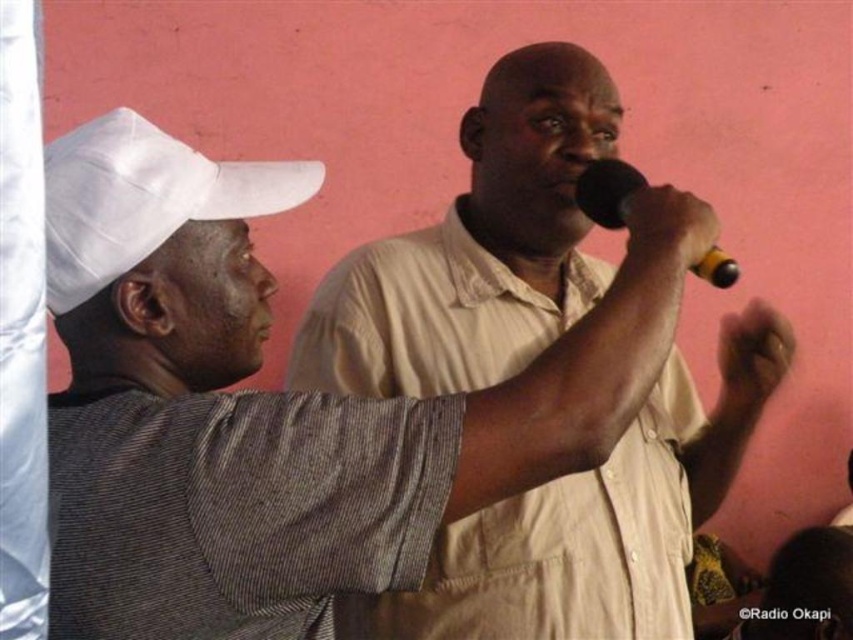
Question: Which object is closer to the camera taking this photo?

Choices:
 (A) black plastic microphone at upper center
 (B) white fabric cap at left
 (C) beige striped shirt at center

Answer: (B)

Question: Which of the following is the farthest from the observer?

Choices:
 (A) pos(624,179)
 (B) pos(48,195)
 (C) pos(654,513)

Answer: (C)

Question: Which object is the closest to the white fabric cap at left?

Choices:
 (A) black plastic microphone at upper center
 (B) beige striped shirt at center

Answer: (B)

Question: Does white fabric cap at left appear on the right side of black plastic microphone at upper center?

Choices:
 (A) yes
 (B) no

Answer: (B)

Question: Where is beige striped shirt at center located in relation to white fabric cap at left in the image?

Choices:
 (A) left
 (B) right

Answer: (B)

Question: Observing the image, what is the correct spatial positioning of beige striped shirt at center in reference to black plastic microphone at upper center?

Choices:
 (A) above
 (B) below

Answer: (B)